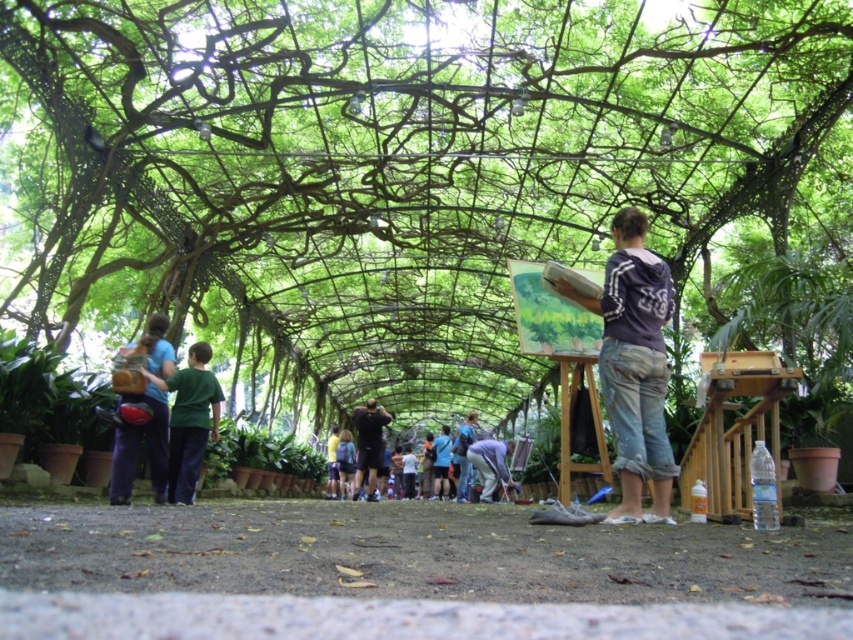
You are a delivery robot with a 2.5 meter long package. You need to navigate through the space between the blue denim jeans at center and the blue backpack at center. Can you fit the package through this space?

The distance between the blue denim jeans at center and the blue backpack at center is 3.29 meters. Since the package is 2.5 meters long, it can fit through the space as the available space is wider than the package.